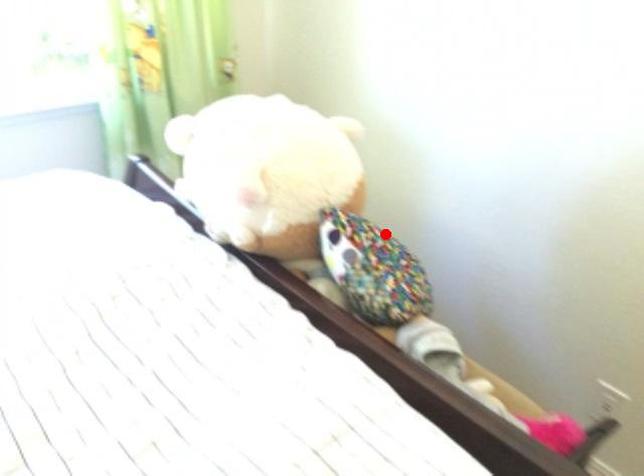
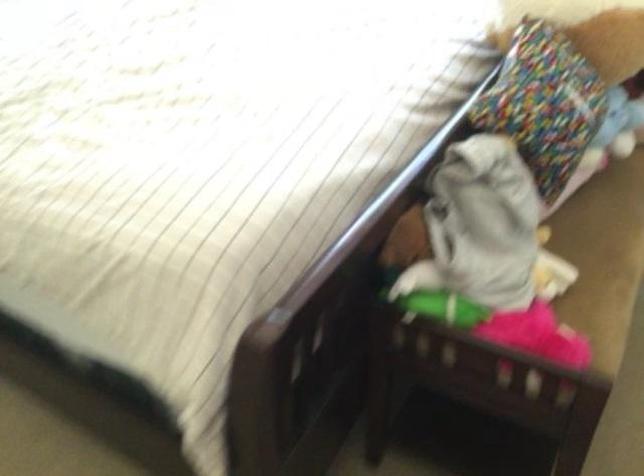
In the second image, find the point that corresponds to the highlighted location in the first image.

(598, 91)